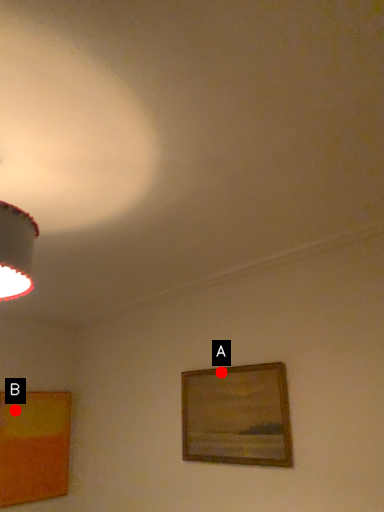
Question: Two points are circled on the image, labeled by A and B beside each circle. Which point appears farthest from the camera in this image?

Choices:
 (A) A is further
 (B) B is further

Answer: (B)